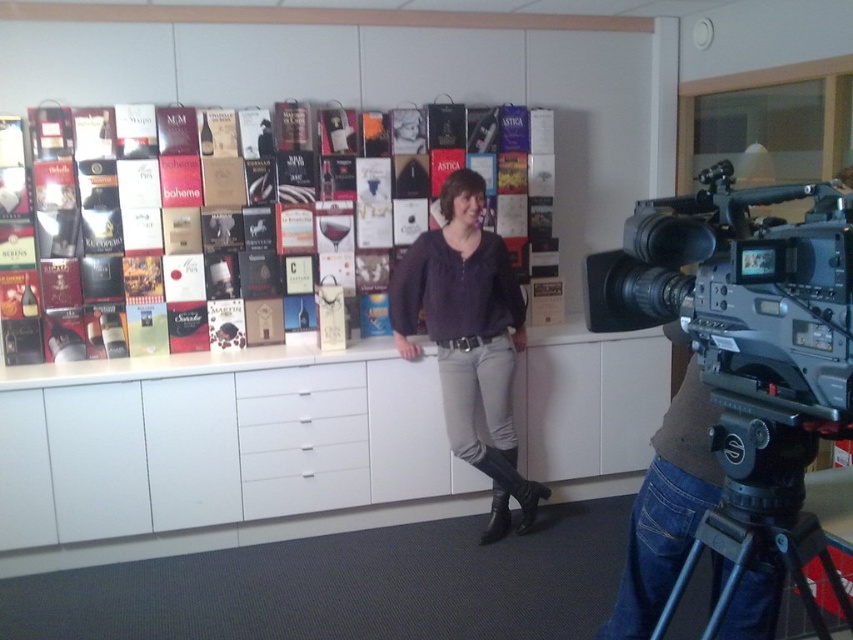
Looking at this image, you are organizing a wine tasting event and need to place a decorative vase on the wall where the matte purple sweater at center and the white glossy drawer at center are. According to the scene description, where should the vase be placed relative to these two items to ensure it stands out?

The matte purple sweater at center is located above the white glossy drawer at center. To make the vase stand out, place it below the white glossy drawer at center so it contrasts with both items.

Consider the image. You are standing in the room and looking at the wall with wine boxes. There are two points marked on the wall at coordinates point (193, 250) and point (541, 497). Which point is closer to you?

Point (193, 250) is closer to the viewer than point (541, 497).

You are standing in a room with a wall covered in wine boxes. You notice a specific point marked at coordinates point (694, 305). If you want to reach this point with your hand, which is about 2 feet long, can you touch it without moving your position?

The distance of point (694, 305) from the camera is 4.71 feet. Since your hand is only 2 feet long, you cannot reach the point without moving closer.